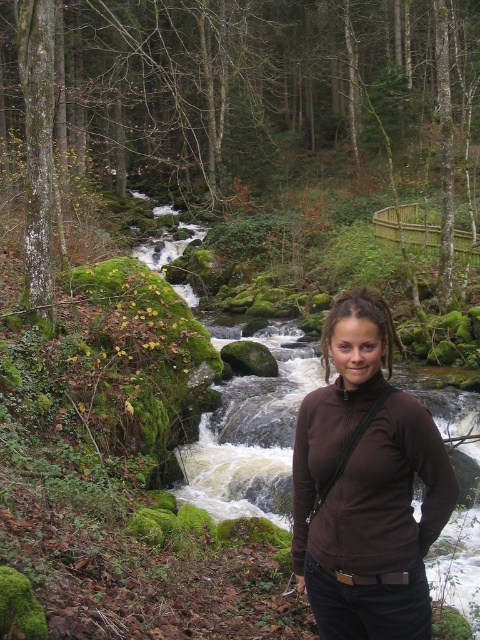
Question: Which of the following is the closest to the observer?

Choices:
 (A) (297, 432)
 (B) (218, 448)

Answer: (A)

Question: Can you confirm if brown matte jacket at center is smaller than white frothy water at center?

Choices:
 (A) yes
 (B) no

Answer: (A)

Question: Is brown matte jacket at center closer to the viewer compared to white frothy water at center?

Choices:
 (A) yes
 (B) no

Answer: (A)

Question: Observing the image, what is the correct spatial positioning of brown matte jacket at center in reference to white frothy water at center?

Choices:
 (A) below
 (B) above

Answer: (A)

Question: Which point is closer to the camera?

Choices:
 (A) [x=301, y=467]
 (B) [x=228, y=326]

Answer: (A)